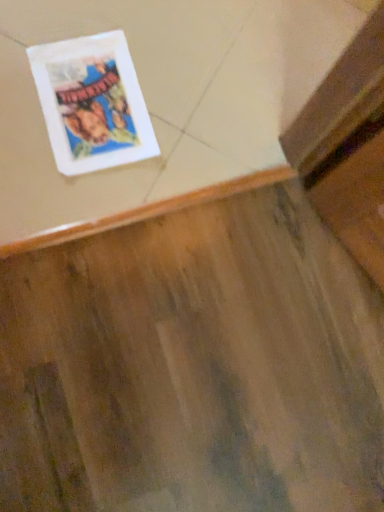
What is the approximate height of white paper at upper left?

The height of white paper at upper left is 1.57 centimeters.

This screenshot has height=512, width=384. Identify the location of white paper at upper left. (92, 103).

What do you see at coordinates (92, 103) in the screenshot?
I see `white paper at upper left` at bounding box center [92, 103].

Image resolution: width=384 pixels, height=512 pixels. Identify the location of white paper at upper left. (92, 103).